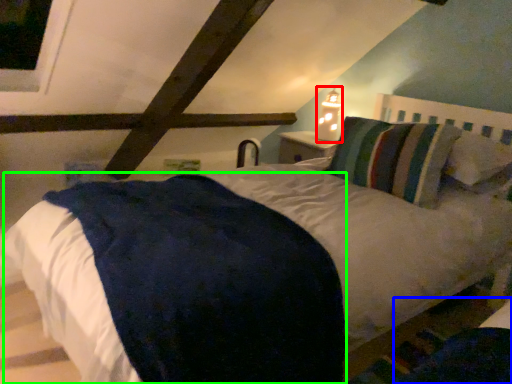
Question: Considering the real-world distances, which object is closest to bedside lamp (highlighted by a red box)? dark (highlighted by a blue box) or mattress (highlighted by a green box).

Choices:
 (A) dark
 (B) mattress

Answer: (B)